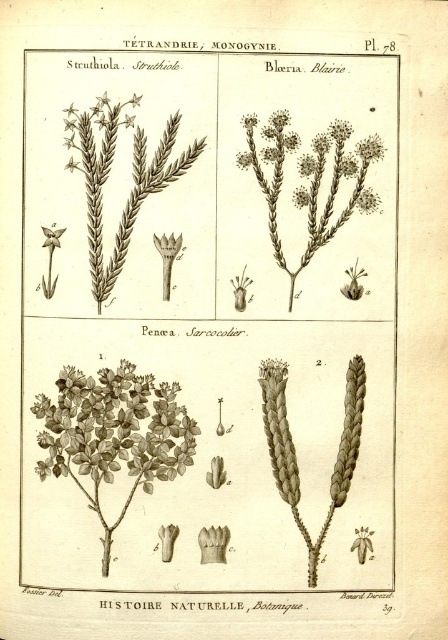
The width and height of the screenshot is (448, 640). Find the location of `brown textured plant at upper left`. brown textured plant at upper left is located at coordinates (107, 176).

Find the location of a particular element. The height and width of the screenshot is (640, 448). brown textured plant at upper left is located at coordinates (107, 176).

What do you see at coordinates (113, 428) in the screenshot? The height and width of the screenshot is (640, 448). I see `green matte bush at center` at bounding box center [113, 428].

Locate an element on the screen. The image size is (448, 640). green matte bush at center is located at coordinates (113, 428).

Find the location of a particular element. green matte bush at center is located at coordinates (113, 428).

Is brown textured plant at center further to camera compared to matte white star at upper left?

That is False.

This screenshot has width=448, height=640. Find the location of `brown textured plant at center`. brown textured plant at center is located at coordinates (294, 451).

You are a GUI agent. You are given a task and a screenshot of the screen. Output one action in this format:
    pyautogui.click(x=<x>, y=<y>)
    Task: Click on the brown textured plant at center
    Image resolution: width=448 pixels, height=640 pixels.
    Given the screenshot: What is the action you would take?
    294,451

Image resolution: width=448 pixels, height=640 pixels. I want to click on brown textured plant at center, so click(x=294, y=451).